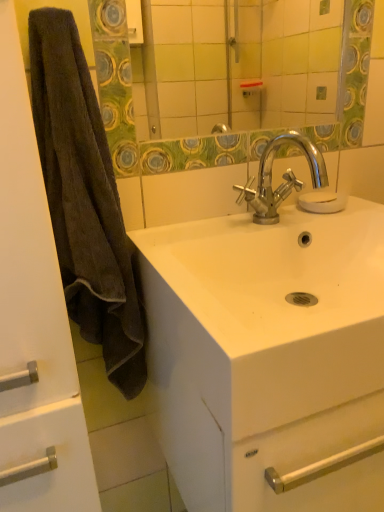
You are a GUI agent. You are given a task and a screenshot of the screen. Output one action in this format:
    pyautogui.click(x=<x>, y=<y>)
    Task: Click on the vacant space underneath chrome metallic faucet at center (from a real-world perspective)
    The image size is (384, 512).
    Given the screenshot: What is the action you would take?
    pyautogui.click(x=272, y=223)